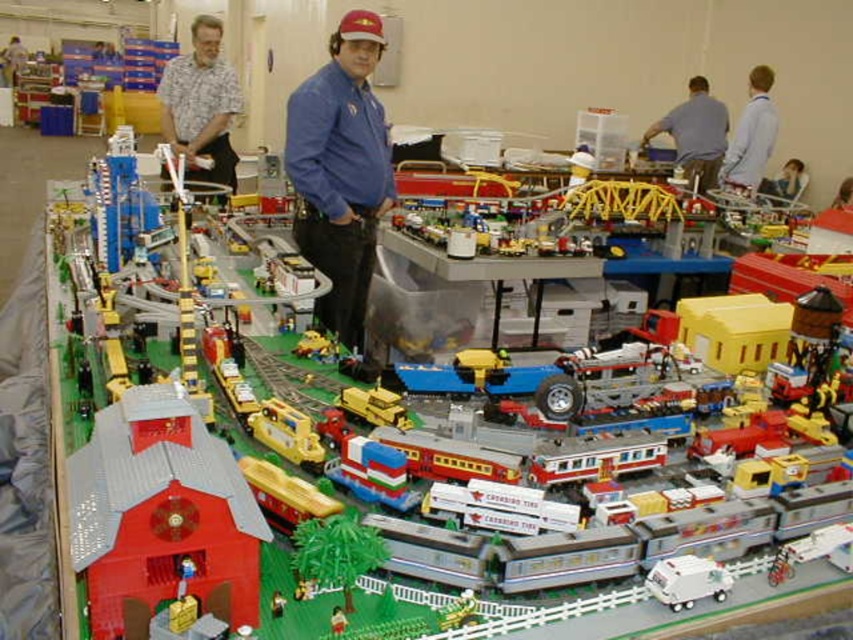
Is point (252, 236) farther from viewer compared to point (703, 109)?

No, (252, 236) is in front of (703, 109).

Does brick red train at center have a greater height compared to blue shirt at upper right?

Yes.

Find the location of `brick red train at center`. brick red train at center is located at coordinates (514, 268).

The height and width of the screenshot is (640, 853). What are the coordinates of `brick red train at center` in the screenshot? It's located at (514, 268).

Which is below, brushed metal shirt at upper left or brushed metal water at bottle left?

brushed metal shirt at upper left is below.

Is brushed metal shirt at upper left to the right of brushed metal water at bottle left from the viewer's perspective?

Indeed, brushed metal shirt at upper left is positioned on the right side of brushed metal water at bottle left.

This screenshot has height=640, width=853. Describe the element at coordinates (201, 106) in the screenshot. I see `brushed metal shirt at upper left` at that location.

Identify the location of brushed metal shirt at upper left. This screenshot has height=640, width=853. [x=201, y=106].

Can you confirm if brick red train at center is positioned below brushed metal water at bottle left?

Yes, brick red train at center is below brushed metal water at bottle left.

Is point (564, 273) farther from viewer compared to point (9, 61)?

No, (564, 273) is closer to viewer.

This screenshot has height=640, width=853. In order to click on brick red train at center in this screenshot , I will do `click(514, 268)`.